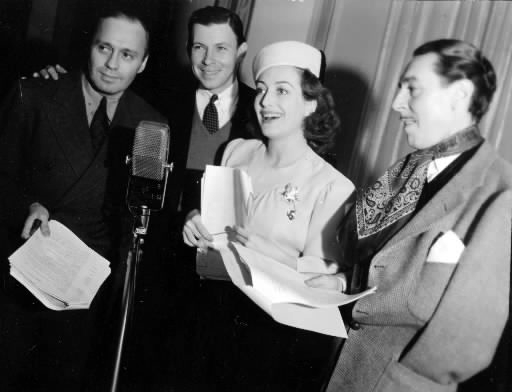
At what (x,y) coordinates should I click in order to perform the action: click on papers. Please return your answer as a coordinate pair (x, y). Looking at the image, I should click on (49, 266).